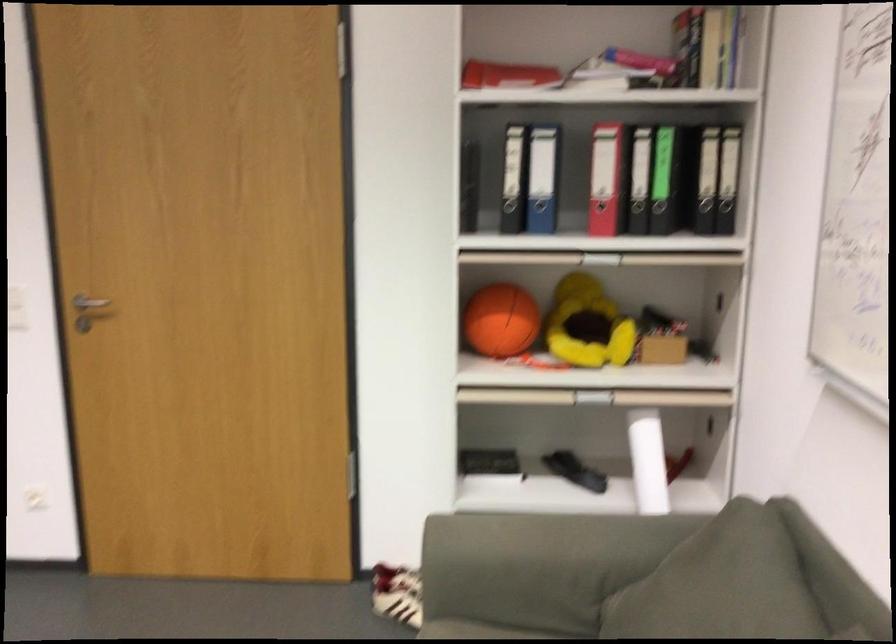
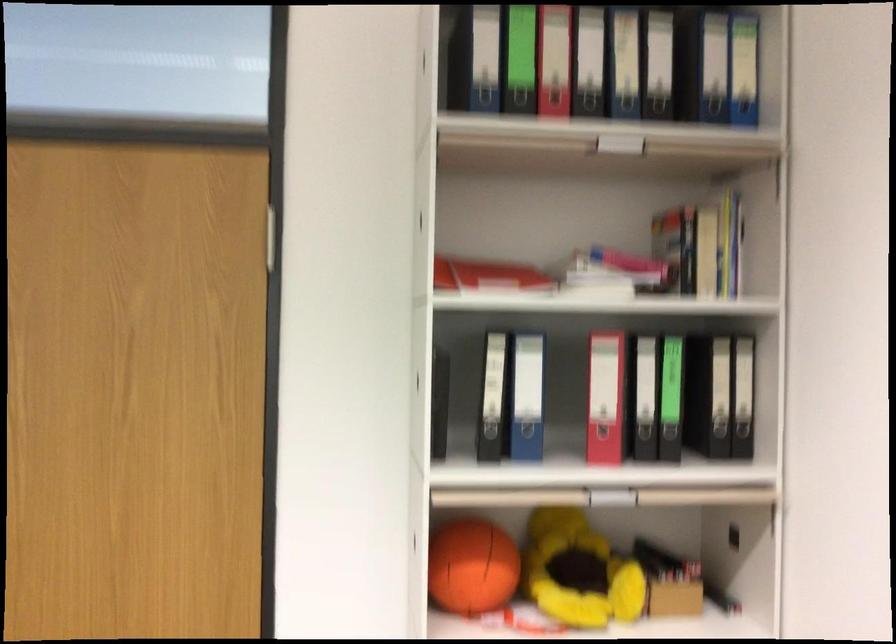
Which direction would the cameraman need to move to produce the second image?

The movement direction of the cameraman is left, forward.